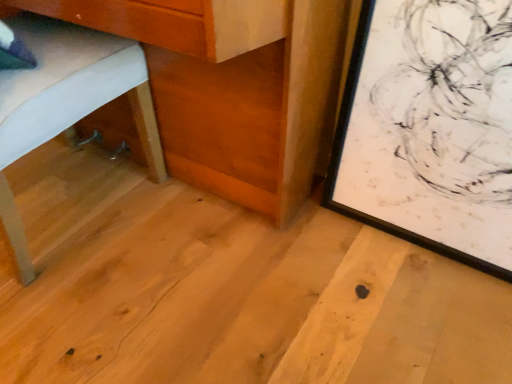
Question: Considering the relative sizes of natural wood table at lower left and matte white bed at left in the image provided, is natural wood table at lower left wider than matte white bed at left?

Choices:
 (A) yes
 (B) no

Answer: (B)

Question: From a real-world perspective, is natural wood table at lower left under matte white bed at left?

Choices:
 (A) no
 (B) yes

Answer: (A)

Question: Does natural wood table at lower left have a greater height compared to matte white bed at left?

Choices:
 (A) yes
 (B) no

Answer: (A)

Question: From the image's perspective, does natural wood table at lower left appear lower than matte white bed at left?

Choices:
 (A) no
 (B) yes

Answer: (A)

Question: From a real-world perspective, does natural wood table at lower left stand above matte white bed at left?

Choices:
 (A) no
 (B) yes

Answer: (B)

Question: Looking at their shapes, would you say black matte picture frame at lower right is wider or thinner than matte white bed at left?

Choices:
 (A) thin
 (B) wide

Answer: (A)

Question: From the image's perspective, is black matte picture frame at lower right located above or below matte white bed at left?

Choices:
 (A) above
 (B) below

Answer: (B)

Question: In the image, is black matte picture frame at lower right on the left side or the right side of matte white bed at left?

Choices:
 (A) left
 (B) right

Answer: (B)

Question: Is black matte picture frame at lower right inside or outside of matte white bed at left?

Choices:
 (A) outside
 (B) inside

Answer: (A)

Question: Would you say natural wood table at lower left is to the left or to the right of black matte picture frame at lower right in the picture?

Choices:
 (A) left
 (B) right

Answer: (A)

Question: Is natural wood table at lower left bigger or smaller than black matte picture frame at lower right?

Choices:
 (A) small
 (B) big

Answer: (B)

Question: From the image's perspective, is natural wood table at lower left above or below black matte picture frame at lower right?

Choices:
 (A) below
 (B) above

Answer: (B)

Question: In terms of width, does natural wood table at lower left look wider or thinner when compared to black matte picture frame at lower right?

Choices:
 (A) thin
 (B) wide

Answer: (B)

Question: Is matte white bed at left in front of or behind natural wood table at lower left in the image?

Choices:
 (A) front
 (B) behind

Answer: (A)

Question: Is matte white bed at left to the left or to the right of natural wood table at lower left in the image?

Choices:
 (A) right
 (B) left

Answer: (B)